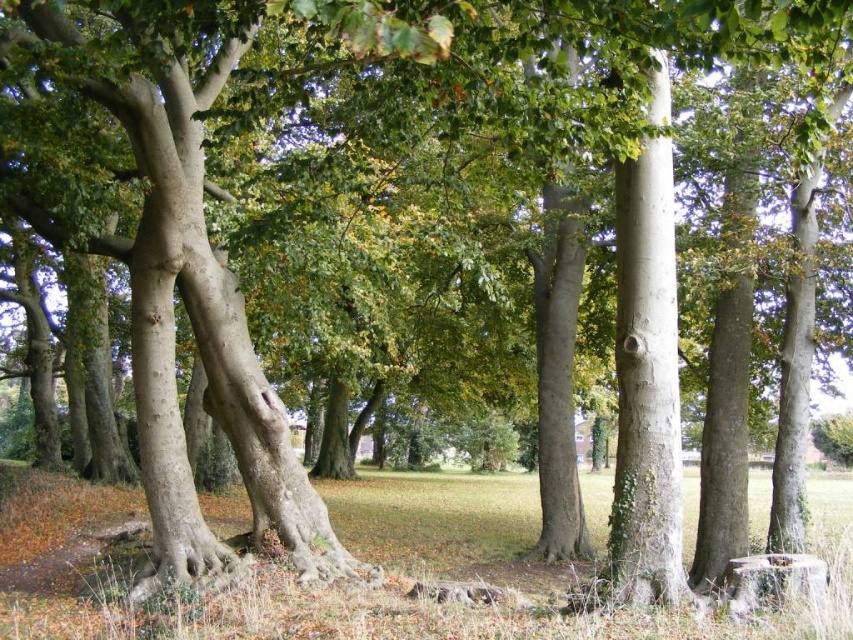
You are a gardener planning to mow the green grass at lower center and trim the smooth gray tree trunk at center. Which task will require more time due to the size of the area or object?

The green grass at lower center is larger in size than the smooth gray tree trunk at center, so mowing the green grass at lower center will take more time because it covers a bigger area.

You are standing in the middle of the grove looking towards the smooth gray tree trunk at center. Which direction should you walk to reach the green grass at lower center?

You should walk to the left to reach the green grass at lower center since it is located to the left of the smooth gray tree trunk at center.